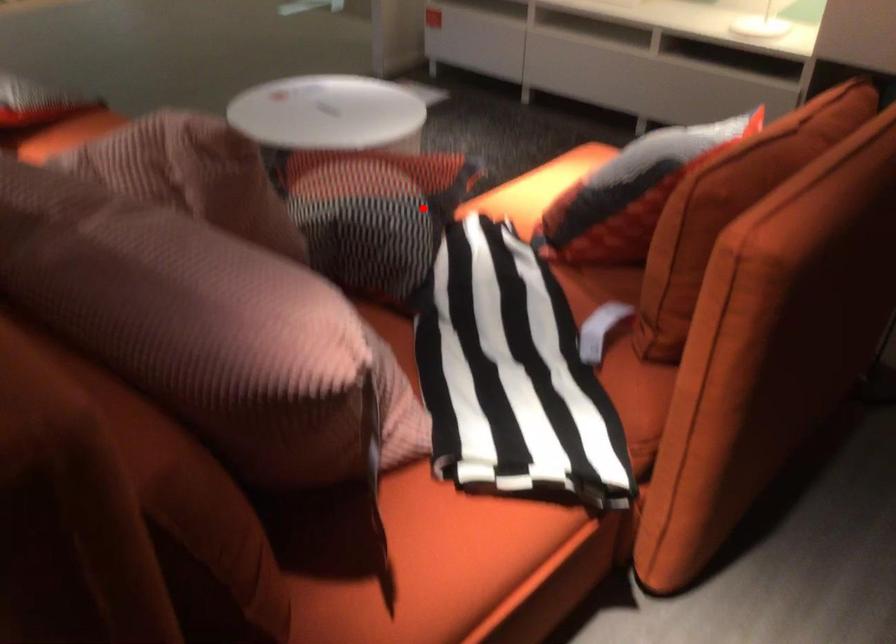
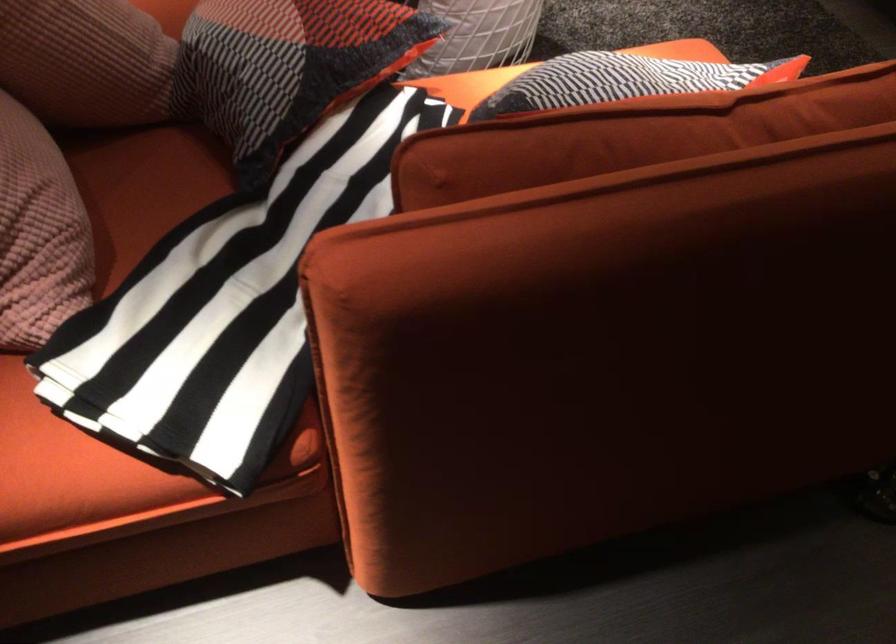
Question: I am providing you with two images of the same scene from different viewpoints. Given a red point in image1, look at the same physical point in image2. Is it:

Choices:
 (A) Closer to the viewpoint
 (B) Farther from the viewpoint

Answer: (A)